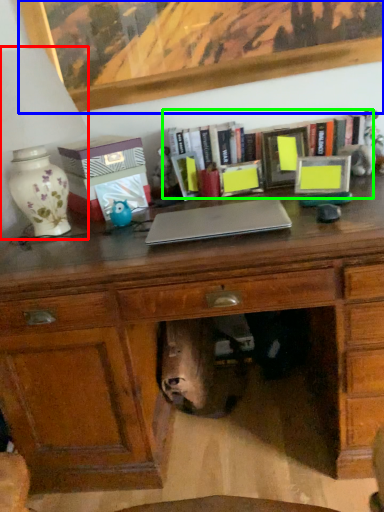
Question: Which is nearer to the table lamp (highlighted by a red box)? picture frame (highlighted by a blue box) or bookcase (highlighted by a green box).

Choices:
 (A) picture frame
 (B) bookcase

Answer: (A)